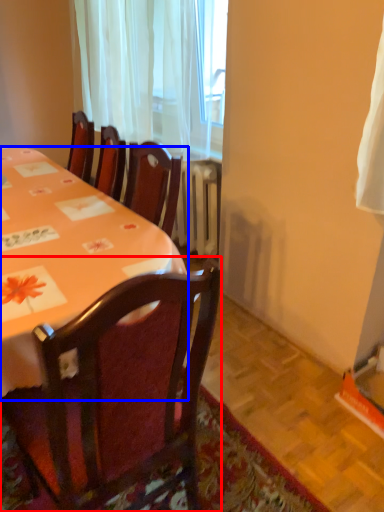
Question: Which object is further to the camera taking this photo, chair (highlighted by a red box) or desk (highlighted by a blue box)?

Choices:
 (A) chair
 (B) desk

Answer: (B)